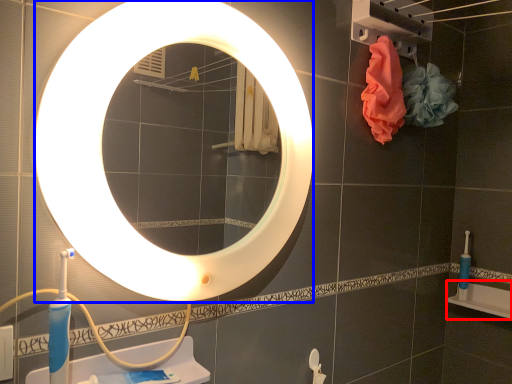
Question: Which object is further to the camera taking this photo, bath (highlighted by a red box) or mirror (highlighted by a blue box)?

Choices:
 (A) bath
 (B) mirror

Answer: (A)